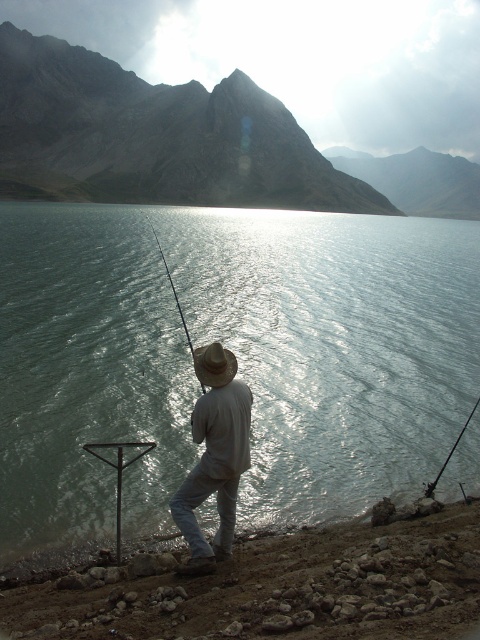
Question: Can you confirm if greenish water at center is thinner than brown woven straw hat at center?

Choices:
 (A) no
 (B) yes

Answer: (A)

Question: Can you confirm if dull brown dirt at lower right is positioned above white cotton shirt at center?

Choices:
 (A) yes
 (B) no

Answer: (B)

Question: Which is nearer to the dull brown dirt at lower right?

Choices:
 (A) greenish water at center
 (B) smooth black rod at center
 (C) shiny metallic fishing pole at center
 (D) brown woven straw hat at center

Answer: (D)

Question: Which is farther from the shiny metallic fishing pole at center?

Choices:
 (A) greenish water at center
 (B) smooth black rod at center
 (C) dull brown dirt at lower right

Answer: (B)

Question: Is brown woven straw hat at center in front of smooth black rod at center?

Choices:
 (A) yes
 (B) no

Answer: (A)

Question: Among these objects, which one is nearest to the camera?

Choices:
 (A) dull brown dirt at lower right
 (B) brown woven straw hat at center
 (C) greenish water at center

Answer: (B)